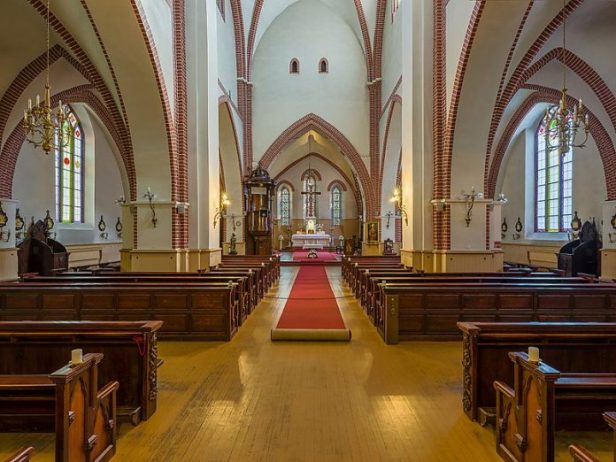
Where is `chandelier`? This screenshot has height=462, width=616. chandelier is located at coordinates (47, 126), (140, 164).